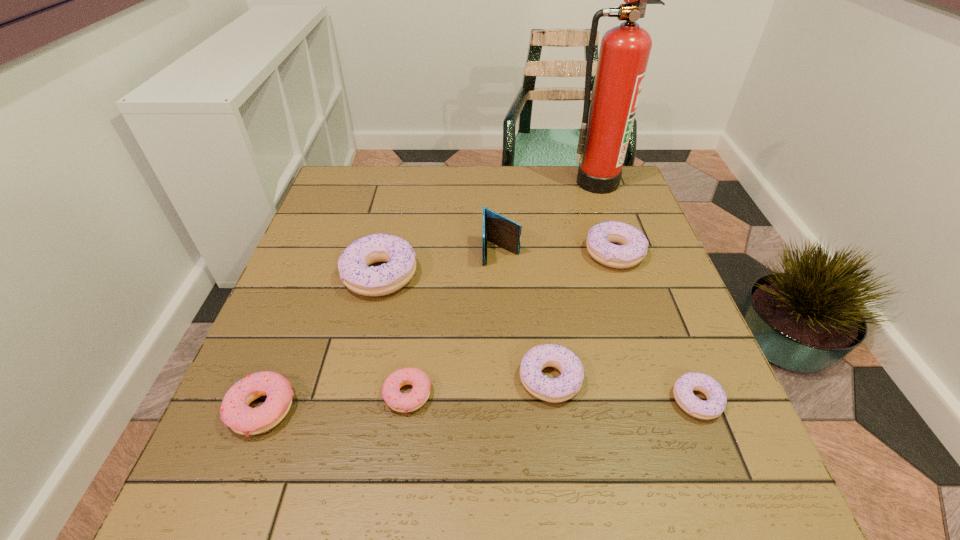
This screenshot has height=540, width=960. I want to click on free space at the far right corner of the desktop, so click(x=596, y=196).

In the image, there is a desktop. Where is `free space at the near right corner`? Image resolution: width=960 pixels, height=540 pixels. free space at the near right corner is located at coordinates (727, 480).

Locate an element on the screen. Image resolution: width=960 pixels, height=540 pixels. empty space between the fifth shortest object and the smaller pink doughnut is located at coordinates (511, 324).

This screenshot has width=960, height=540. Identify the location of vacant space that's between the leftmost purple doughnut and the third purple doughnut from right to left. (465, 327).

What are the coordinates of `free spot between the third purple doughnut from right to left and the blue wallet` in the screenshot? It's located at (525, 315).

Find the location of `vacant point located between the smallest purple doughnut and the second tallest doughnut`. vacant point located between the smallest purple doughnut and the second tallest doughnut is located at coordinates (656, 327).

The image size is (960, 540). Identify the location of free spot between the smallest purple doughnut and the second tallest doughnut. pos(656,327).

At what (x,y) coordinates should I click in order to perform the action: click on free spot between the bigger pink doughnut and the tallest object. Please return your answer as a coordinate pair (x, y). The image size is (960, 540). Looking at the image, I should click on (429, 295).

Image resolution: width=960 pixels, height=540 pixels. In order to click on free area in between the leftmost doughnut and the wallet in this screenshot , I will do `click(381, 330)`.

I want to click on vacant space that is in between the fifth shortest doughnut and the second purple doughnut from left to right, so [x=583, y=316].